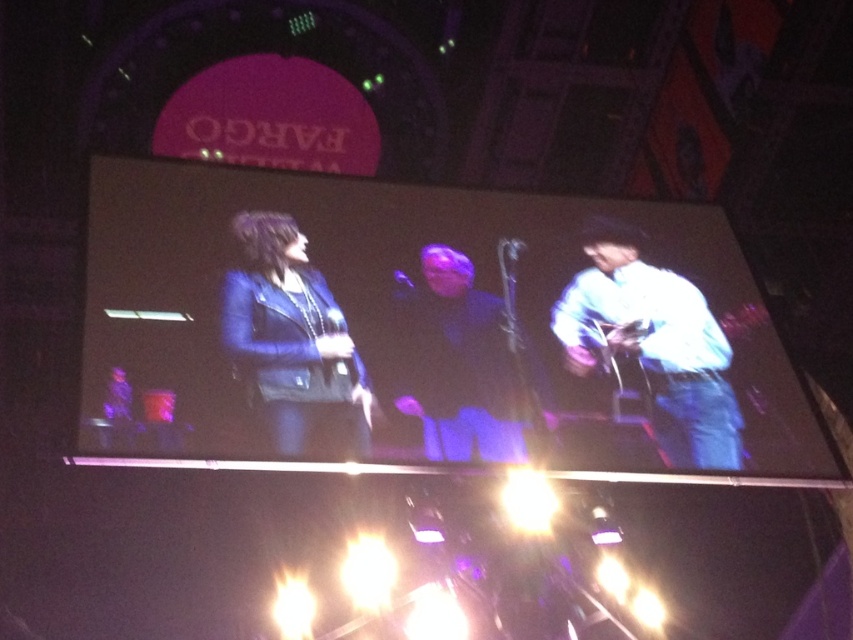
Is point (291, 342) positioned in front of point (637, 250)?

Yes, point (291, 342) is in front of point (637, 250).

Between point (312, 296) and point (680, 284), which one is positioned behind?

Positioned behind is point (680, 284).

I want to click on blue leather jacket at center, so click(x=292, y=342).

Is blue leather jacket at center to the right of dark blue leather jacket at center from the viewer's perspective?

Incorrect, blue leather jacket at center is not on the right side of dark blue leather jacket at center.

Which is behind, point (273, 244) or point (444, 276)?

The point (444, 276) is more distant.

Measure the distance between point (x=262, y=282) and camera.

The distance of point (x=262, y=282) from camera is 14.34 meters.

Where is `blue leather jacket at center`? The width and height of the screenshot is (853, 640). blue leather jacket at center is located at coordinates (292, 342).

Does white matte shirt at center lie behind dark blue leather jacket at center?

Yes, it is behind dark blue leather jacket at center.

Who is taller, white matte shirt at center or dark blue leather jacket at center?

Standing taller between the two is white matte shirt at center.

Is point (587, 291) behind point (497, 406)?

Yes, it is behind point (497, 406).

This screenshot has width=853, height=640. Find the location of `white matte shirt at center`. white matte shirt at center is located at coordinates (654, 342).